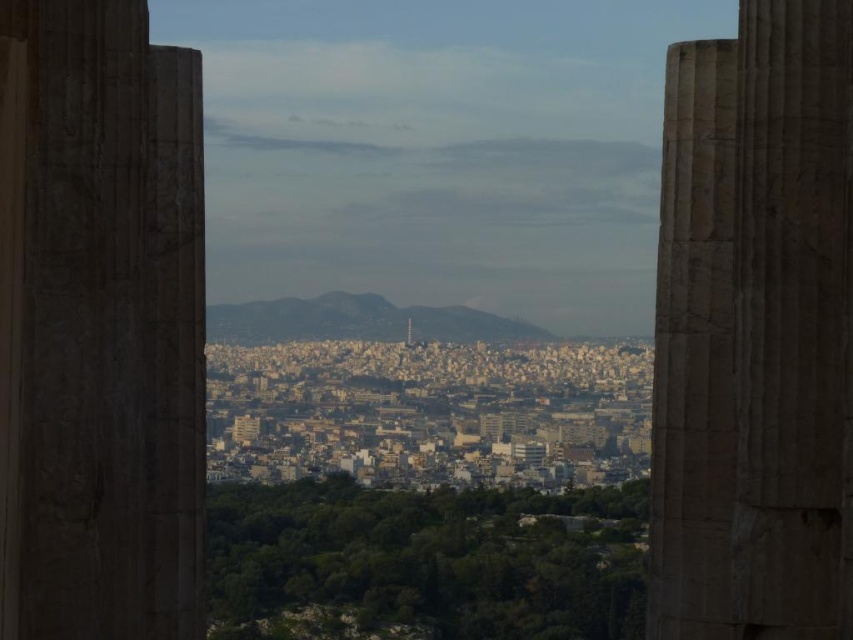
You are an architect analyzing the symmetry of the ancient structure. Given the positions of the marble column at center and the marble column at right, which column is positioned to the left of the other?

The marble column at right is positioned to the left of the marble column at center.

You are standing at the viewpoint where the two large stone columns frame the city. You notice two points marked in the image. Which of the two points, point (108, 413) or point (712, 93), is nearer to you?

Point (108, 413) is closer to the camera than point (712, 93), so it is nearer to you.

You are standing at the center of the image and want to locate the marble column at center. What are the coordinates where you should look?

The marble column at center is located at coordinates point (x=753, y=330).